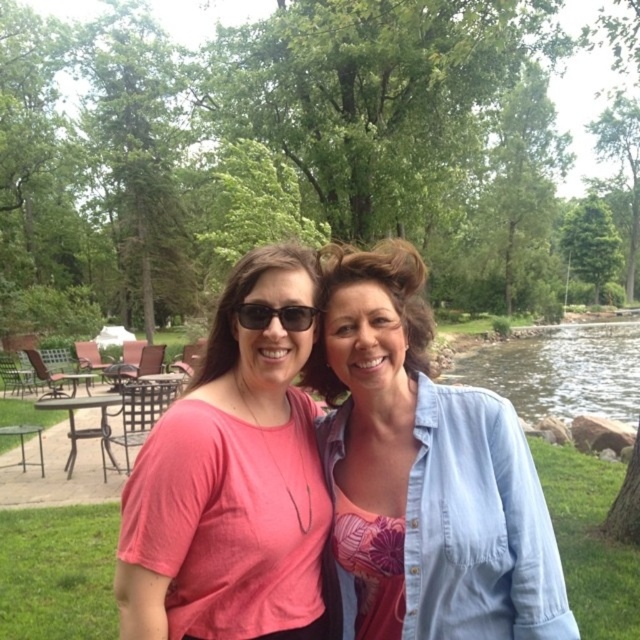
Question: Is light blue denim shirt at center bigger than clear water at right?

Choices:
 (A) no
 (B) yes

Answer: (A)

Question: Among these objects, which one is nearest to the camera?

Choices:
 (A) matte black sunglasses at center
 (B) clear water at right

Answer: (A)

Question: Among these points, which one is nearest to the camera?

Choices:
 (A) (296, 330)
 (B) (496, 342)
 (C) (300, 563)

Answer: (A)

Question: From the image, what is the correct spatial relationship of light blue denim shirt at center in relation to pink fabric shirt at center?

Choices:
 (A) right
 (B) left

Answer: (A)

Question: Is light blue denim shirt at center positioned before matte black sunglasses at center?

Choices:
 (A) yes
 (B) no

Answer: (A)

Question: Which of the following is the farthest from the observer?

Choices:
 (A) pink fabric shirt at center
 (B) brown metal picnic table at lower left

Answer: (B)